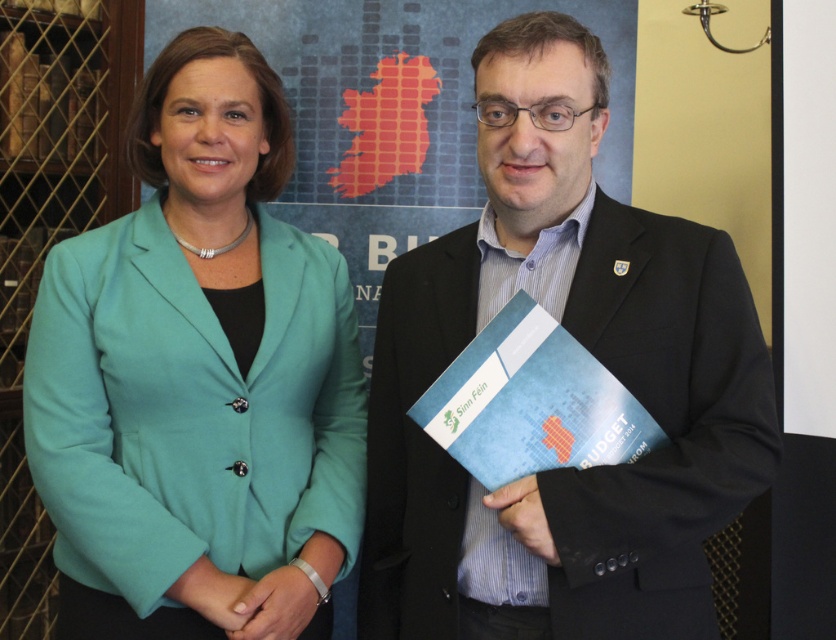
Question: Can you confirm if teal fabric jacket at center is positioned to the left of matte black suit at center?

Choices:
 (A) no
 (B) yes

Answer: (B)

Question: Among these objects, which one is farthest from the camera?

Choices:
 (A) teal fabric jacket at center
 (B) matte black suit at center

Answer: (A)

Question: Which point is farther to the camera?

Choices:
 (A) teal fabric jacket at center
 (B) matte black suit at center

Answer: (A)

Question: Does teal fabric jacket at center lie in front of matte black suit at center?

Choices:
 (A) no
 (B) yes

Answer: (A)

Question: Which point is farther to the camera?

Choices:
 (A) teal fabric jacket at center
 (B) matte black suit at center

Answer: (A)

Question: Does teal fabric jacket at center appear on the right side of matte black suit at center?

Choices:
 (A) no
 (B) yes

Answer: (A)